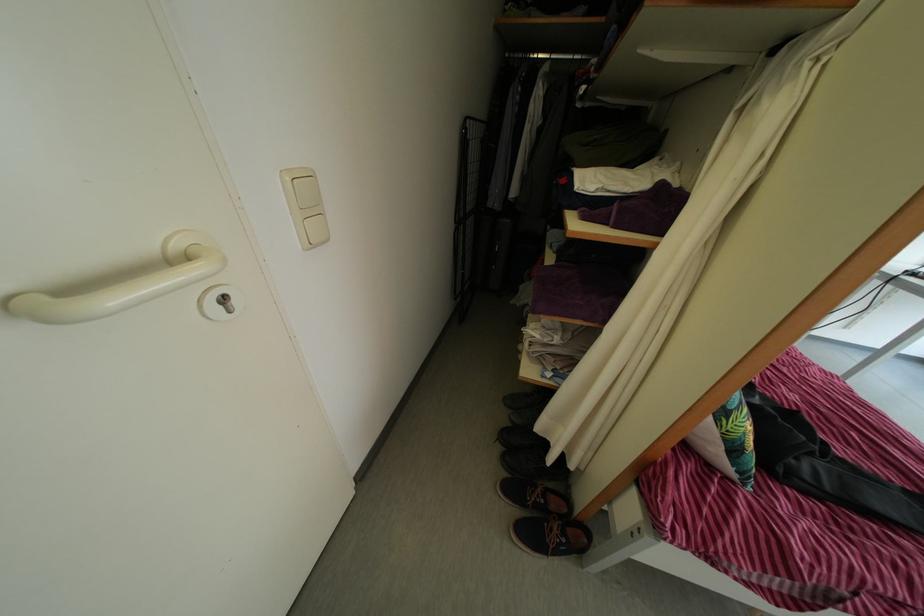
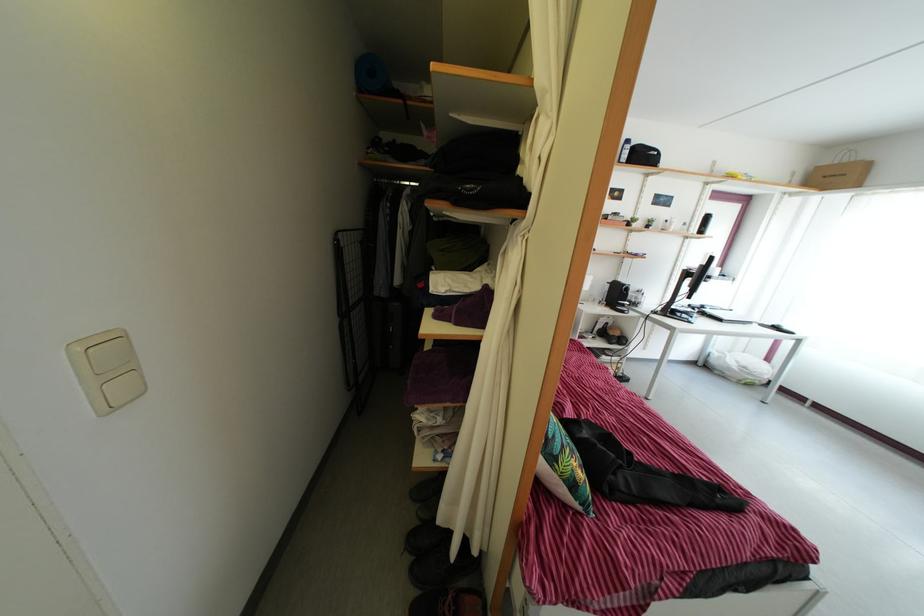
Question: The images are taken continuously from a first-person perspective. In which direction is your viewpoint rotating?

Choices:
 (A) Left
 (B) Right
 (C) Up
 (D) Down

Answer: (B)